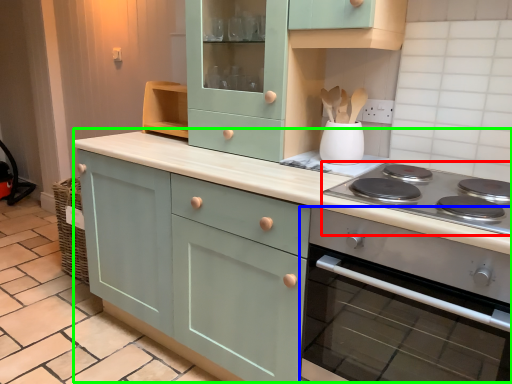
Question: Which is farther away from gas stove (highlighted by a red box)? home appliance (highlighted by a blue box) or cabinetry (highlighted by a green box)?

Choices:
 (A) home appliance
 (B) cabinetry

Answer: (B)